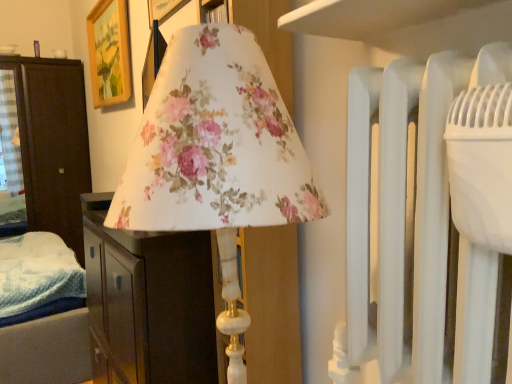
Question: Considering the positions of dark wood wardrobe at left, the first furniture positioned from the left, and floral fabric lampshade at center, the 1th furniture in the front-to-back sequence, in the image, is dark wood wardrobe at left, the first furniture positioned from the left, taller or shorter than floral fabric lampshade at center, the 1th furniture in the front-to-back sequence,?

Choices:
 (A) short
 (B) tall

Answer: (B)

Question: Is point (64, 241) closer or farther from the camera than point (205, 294)?

Choices:
 (A) closer
 (B) farther

Answer: (B)

Question: Which is farther from the floral fabric lampshade at center, placed as the second furniture when sorted from left to right?

Choices:
 (A) wooden picture frame at upper left
 (B) dark wood wardrobe at left, arranged as the second furniture when viewed from the front

Answer: (B)

Question: Based on their relative distances, which object is farther from the dark wood wardrobe at left, arranged as the second furniture when viewed from the front?

Choices:
 (A) floral fabric lampshade at center, placed as the second furniture when sorted from left to right
 (B) wooden picture frame at upper left

Answer: (A)